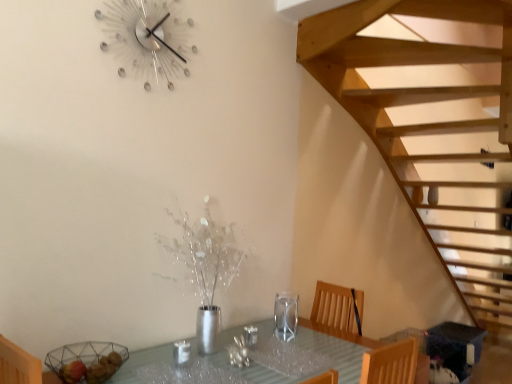
Question: Would you say clear glass table at center is a long distance from transparent glass wine glass at center?

Choices:
 (A) yes
 (B) no

Answer: (B)

Question: Does clear glass table at center turn towards transparent glass wine glass at center?

Choices:
 (A) no
 (B) yes

Answer: (A)

Question: Considering the relative sizes of clear glass table at center and transparent glass wine glass at center in the image provided, is clear glass table at center bigger than transparent glass wine glass at center?

Choices:
 (A) no
 (B) yes

Answer: (B)

Question: Is clear glass table at center to the left of transparent glass wine glass at center from the viewer's perspective?

Choices:
 (A) yes
 (B) no

Answer: (A)

Question: From the image's perspective, is clear glass table at center located beneath transparent glass wine glass at center?

Choices:
 (A) no
 (B) yes

Answer: (B)

Question: Is clear glass table at center shorter than transparent glass wine glass at center?

Choices:
 (A) no
 (B) yes

Answer: (A)

Question: Is transparent glass wine glass at center shorter than metallic crystal wall clock at upper center?

Choices:
 (A) no
 (B) yes

Answer: (B)

Question: From the image's perspective, is transparent glass wine glass at center located above metallic crystal wall clock at upper center?

Choices:
 (A) yes
 (B) no

Answer: (B)

Question: Considering the relative sizes of transparent glass wine glass at center and metallic crystal wall clock at upper center in the image provided, is transparent glass wine glass at center thinner than metallic crystal wall clock at upper center?

Choices:
 (A) yes
 (B) no

Answer: (B)

Question: Is transparent glass wine glass at center bigger than metallic crystal wall clock at upper center?

Choices:
 (A) yes
 (B) no

Answer: (B)

Question: From a real-world perspective, does transparent glass wine glass at center stand above metallic crystal wall clock at upper center?

Choices:
 (A) no
 (B) yes

Answer: (A)

Question: Is transparent glass wine glass at center closer to camera compared to metallic crystal wall clock at upper center?

Choices:
 (A) yes
 (B) no

Answer: (B)

Question: Is transparent glass wine glass at center turned away from clear glass table at center?

Choices:
 (A) no
 (B) yes

Answer: (A)